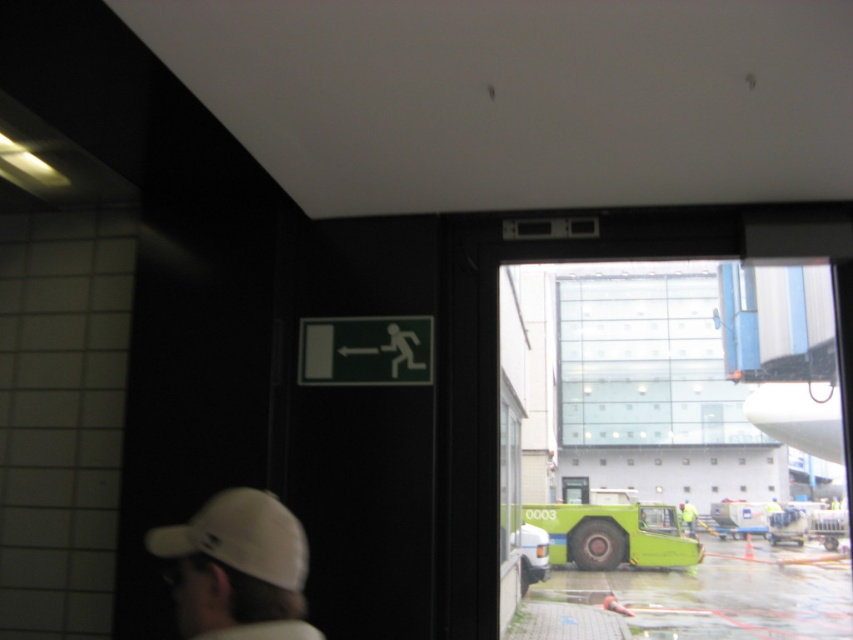
You are standing in a building and looking through the doorway. There is a point marked at coordinates (x=364, y=349). What object is located at that point?

The green matte exit sign at upper center is located at point (x=364, y=349).

In the scene shown: You are a maintenance worker in an airport and you see the white matte baseball cap at lower left and the yellow reflective vest at center. Which object is closer to you?

The white matte baseball cap at lower left is closer to you because it is in front of the yellow reflective vest at center.

You are a safety inspector checking the visibility of workers in the airport area. You notice the white matte baseball cap at lower left and the yellow reflective vest at center. Which item is shorter in height?

The white matte baseball cap at lower left has a lesser height compared to the yellow reflective vest at center, so the white matte baseball cap at lower left is shorter in height.